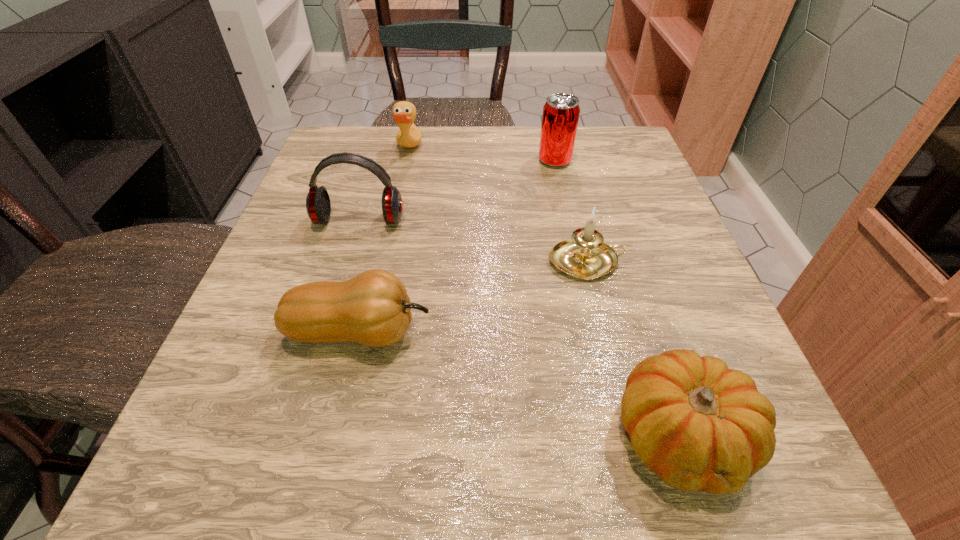
Locate an element on the screen. free location located 0.220m on the beak of the duck is located at coordinates (519, 150).

Locate an element on the screen. vacant region located on the stem side of the second nearest object is located at coordinates (679, 332).

Identify the location of free location located 0.330m on the left of the nearest object. (342, 436).

I want to click on soda can present at the far edge, so click(561, 112).

Where is `duck located at the far edge`? duck located at the far edge is located at coordinates click(404, 113).

Image resolution: width=960 pixels, height=540 pixels. What are the coordinates of `object that is at the near edge` in the screenshot? It's located at (700, 426).

Find the location of a particular element. The image size is (960, 540). earphone that is at the left edge is located at coordinates (318, 206).

The height and width of the screenshot is (540, 960). I want to click on gourd at the left edge, so click(x=373, y=309).

Identify the location of soda can positioned at the right edge. Image resolution: width=960 pixels, height=540 pixels. (561, 112).

This screenshot has width=960, height=540. In order to click on candle holder situated at the right edge in this screenshot , I will do `click(582, 257)`.